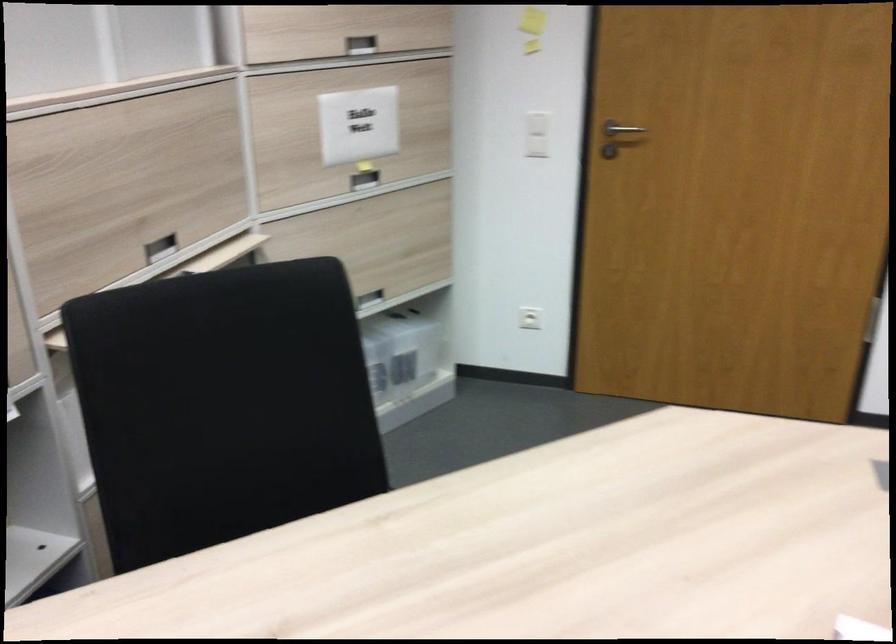
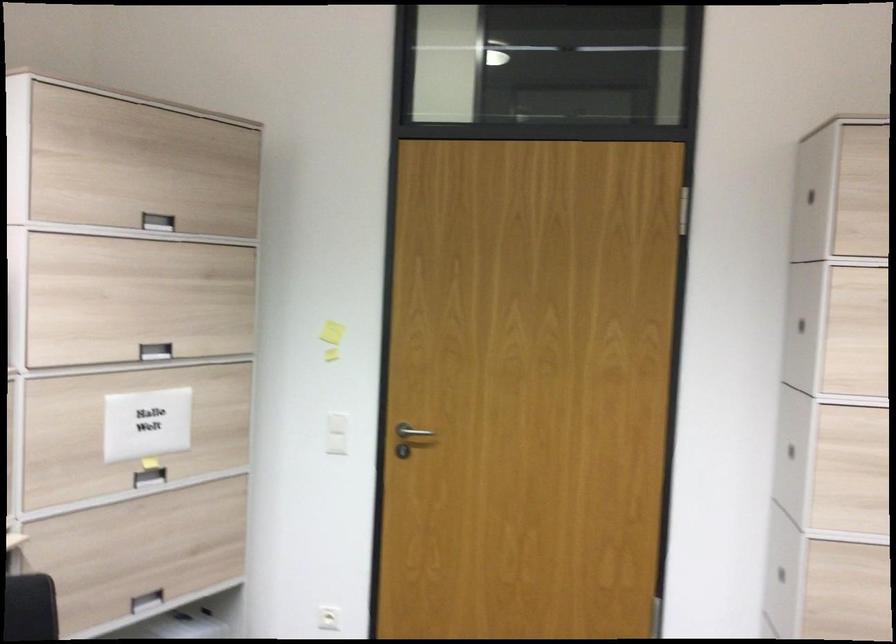
Question: Based on the continuous images, in which direction is the camera rotating? Reply with the corresponding letter.

Choices:
 (A) Left
 (B) Right
 (C) Up
 (D) Down

Answer: (C)